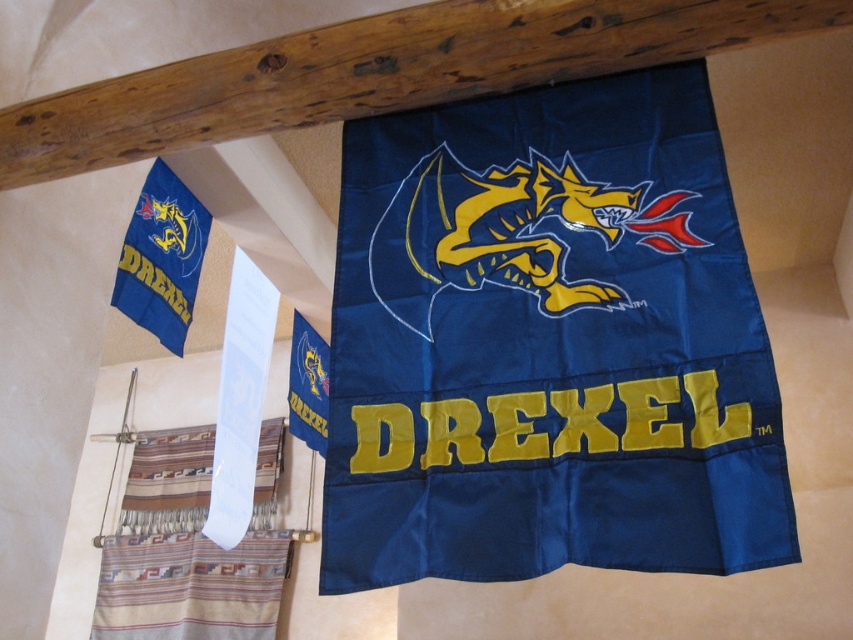
Who is shorter, striped fabric curtain at lower left or blue fabric flag at upper center?

With less height is blue fabric flag at upper center.

Does striped fabric curtain at lower left have a larger size compared to blue fabric flag at upper center?

Yes, striped fabric curtain at lower left is bigger than blue fabric flag at upper center.

The image size is (853, 640). Identify the location of striped fabric curtain at lower left. (190, 547).

Looking at this image, can you confirm if navy blue fabric flag at center is thinner than striped fabric curtain at lower left?

Indeed, navy blue fabric flag at center has a lesser width compared to striped fabric curtain at lower left.

Between point (693, 525) and point (151, 499), which one is positioned behind?

The point (151, 499) is more distant.

Between point (486, 483) and point (161, 438), which one is positioned in front?

Point (486, 483) is in front.

Identify the location of navy blue fabric flag at center. (548, 344).

Who is more forward, (625,154) or (28,120)?

Point (625,154)

Who is taller, navy blue fabric flag at center or brown wooden beam at upper center?

navy blue fabric flag at center

Between point (404, 577) and point (76, 134), which one is positioned behind?

The point (76, 134) is more distant.

Where is `navy blue fabric flag at center`? The width and height of the screenshot is (853, 640). navy blue fabric flag at center is located at coordinates (548, 344).